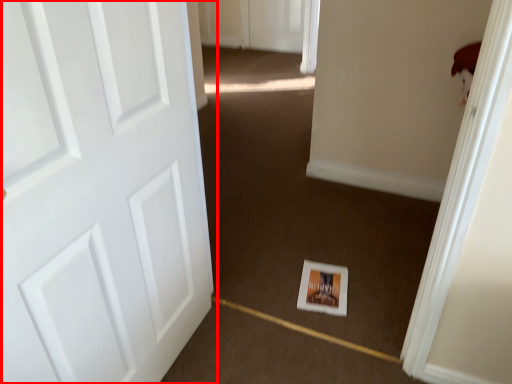
Question: From the image's perspective, what is the correct spatial relationship of door (annotated by the red box) in relation to postcard?

Choices:
 (A) below
 (B) above

Answer: (B)